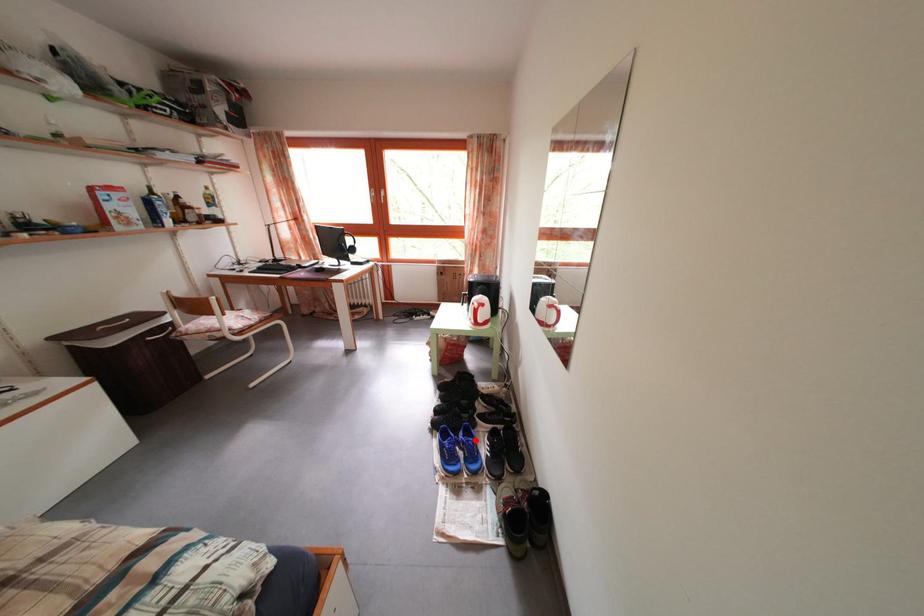
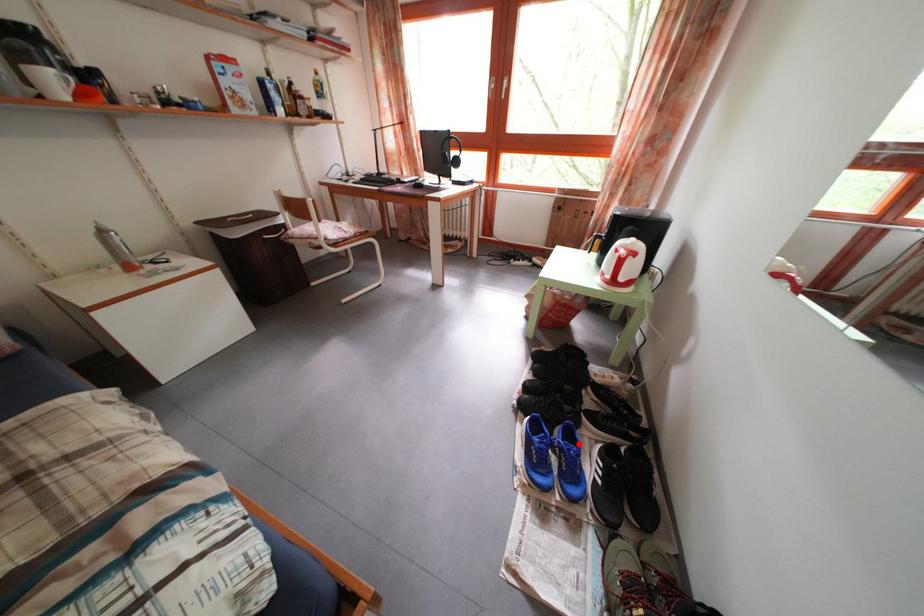
I am providing you with two images of the same scene from different viewpoints. A red point is marked on the first image and another point is marked on the second image. Are the points marked in image1 and image2 representing the same 3D position?

Yes